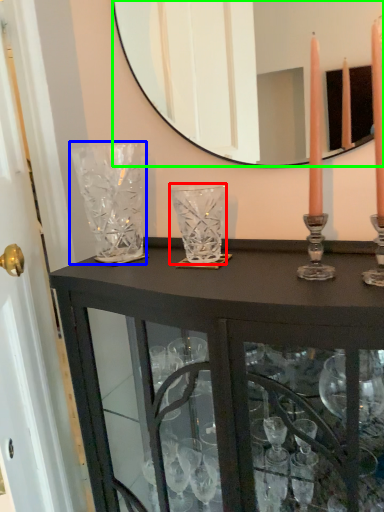
Question: Which is farther away from glass vase (highlighted by a red box)? glass vase (highlighted by a blue box) or mirror (highlighted by a green box)?

Choices:
 (A) glass vase
 (B) mirror

Answer: (B)